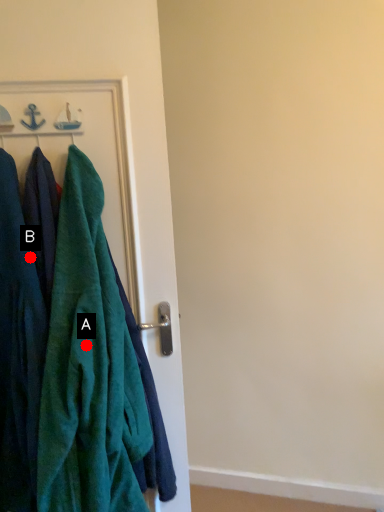
Question: Two points are circled on the image, labeled by A and B beside each circle. Which point is closer to the camera taking this photo?

Choices:
 (A) A is closer
 (B) B is closer

Answer: (A)